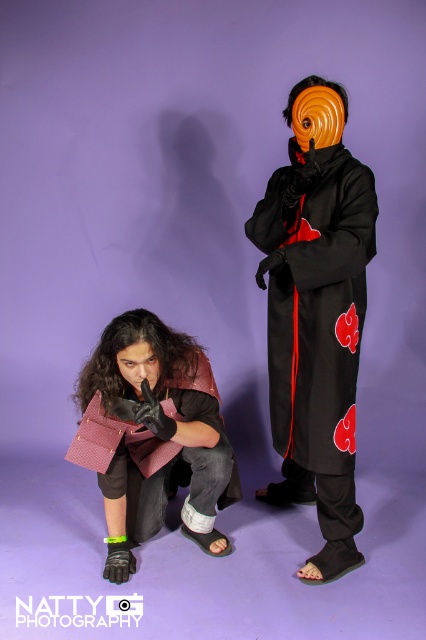
Question: Does black matte/soft fabric at center have a greater width compared to leather-like burgundy purse at lower left?

Choices:
 (A) no
 (B) yes

Answer: (A)

Question: Does black matte/soft fabric at center come in front of leather-like burgundy purse at lower left?

Choices:
 (A) no
 (B) yes

Answer: (A)

Question: Does black matte/soft fabric at center appear over leather-like burgundy purse at lower left?

Choices:
 (A) no
 (B) yes

Answer: (B)

Question: Which point appears farthest from the camera in this image?

Choices:
 (A) (198, 470)
 (B) (314, 477)

Answer: (B)

Question: Which point appears farthest from the camera in this image?

Choices:
 (A) (210, 387)
 (B) (359, 324)

Answer: (B)

Question: Which point is farther from the camera taking this photo?

Choices:
 (A) (328, 227)
 (B) (140, 384)

Answer: (A)